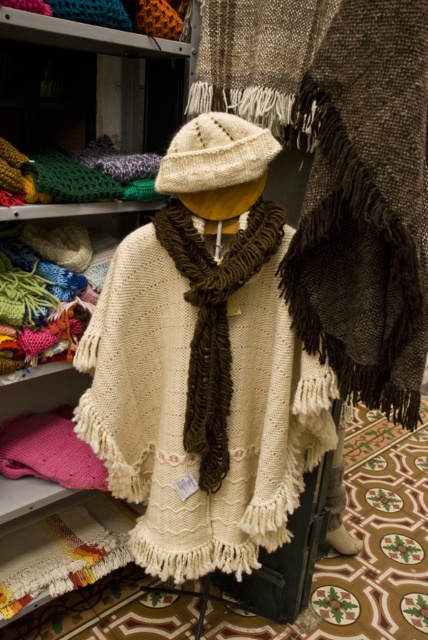
Is point (258, 419) positioned after point (391, 356)?

Yes, it is behind point (391, 356).

The height and width of the screenshot is (640, 428). I want to click on white knitted poncho at center, so click(202, 392).

What are the coordinates of `white knitted poncho at center` in the screenshot? It's located at (202, 392).

Does white knitted poncho at center appear under brown knitted scarf at center?

Yes, white knitted poncho at center is below brown knitted scarf at center.

Describe the element at coordinates (202, 392) in the screenshot. I see `white knitted poncho at center` at that location.

Locate an element on the screen. white knitted poncho at center is located at coordinates click(202, 392).

Image resolution: width=428 pixels, height=640 pixels. Find the location of `white knitted poncho at center`. white knitted poncho at center is located at coordinates (202, 392).

Describe the element at coordinates (365, 204) in the screenshot. I see `dark brown textured shawl at center` at that location.

Who is taller, dark brown textured shawl at center or brown knitted scarf at center?

Standing taller between the two is dark brown textured shawl at center.

The width and height of the screenshot is (428, 640). What do you see at coordinates (365, 204) in the screenshot? I see `dark brown textured shawl at center` at bounding box center [365, 204].

At what (x,y) coordinates should I click in order to perform the action: click on dark brown textured shawl at center. Please return your answer as a coordinate pair (x, y). This screenshot has height=640, width=428. Looking at the image, I should click on (365, 204).